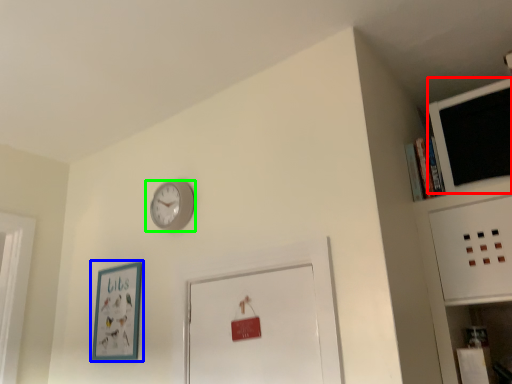
Question: Based on their relative distances, which object is nearer to computer monitor (highlighted by a red box)? Choose from picture frame (highlighted by a blue box) and wall clock (highlighted by a green box).

Choices:
 (A) picture frame
 (B) wall clock

Answer: (B)